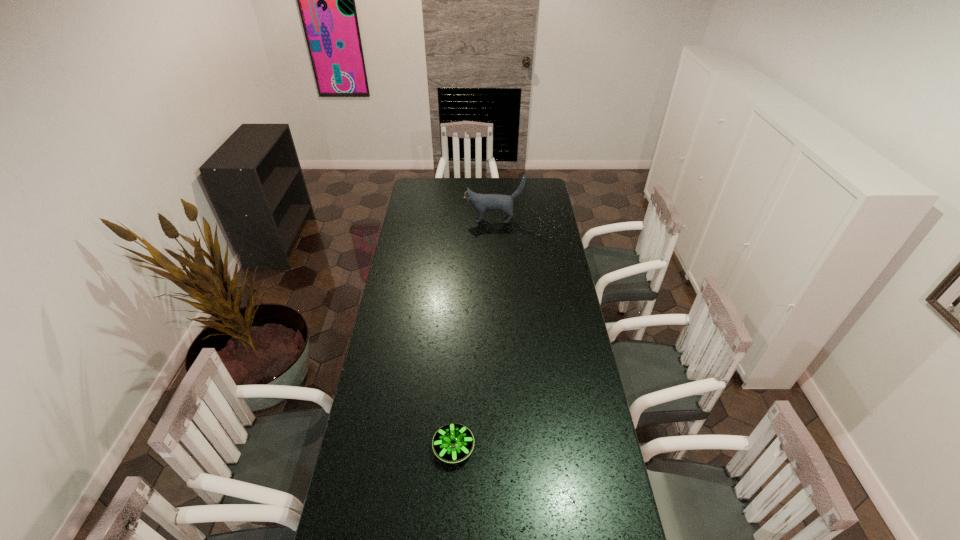
Locate an element on the screen. The width and height of the screenshot is (960, 540). the taller object is located at coordinates (482, 202).

Identify the location of the farther object. The width and height of the screenshot is (960, 540). (482, 202).

Locate an element on the screen. the nearer object is located at coordinates (452, 443).

Find the location of a particular element. saucer is located at coordinates (452, 443).

Identify the location of blank space located at the face of the farther object. (406, 220).

The image size is (960, 540). Identify the location of vacant space located at the face of the farther object. (438, 220).

You are a GUI agent. You are given a task and a screenshot of the screen. Output one action in this format:
    pyautogui.click(x=<x>, y=<y>)
    Task: Click on the blank space located 0.210m at the face of the farther object
    Image resolution: width=960 pixels, height=540 pixels.
    Given the screenshot: What is the action you would take?
    pyautogui.click(x=425, y=220)

Locate an element on the screen. free space located 0.300m on the right of the saucer is located at coordinates (564, 448).

Identify the location of vacant space at the left edge of the desktop. (340, 504).

Identify the location of blank space at the right edge of the desktop. (544, 322).